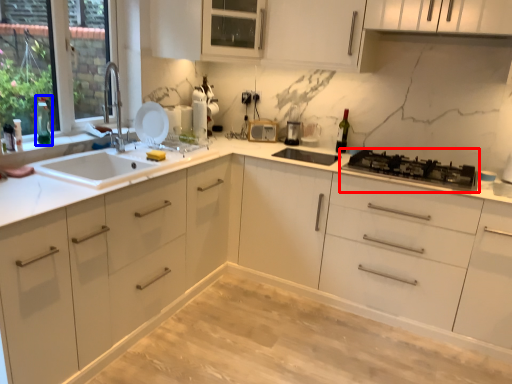
Question: Among these objects, which one is nearest to the camera, gas stove (highlighted by a red box) or bottle (highlighted by a blue box)?

Choices:
 (A) gas stove
 (B) bottle

Answer: (A)